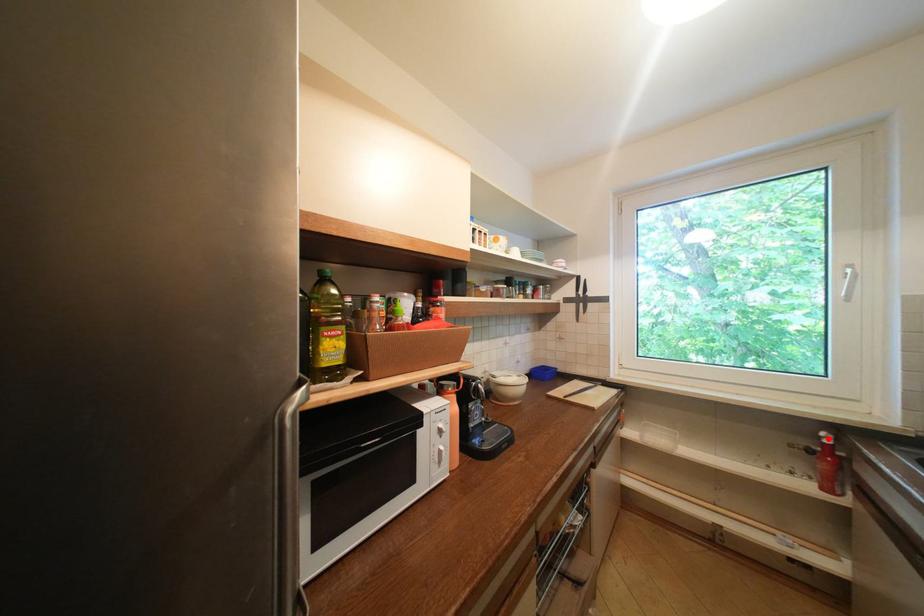
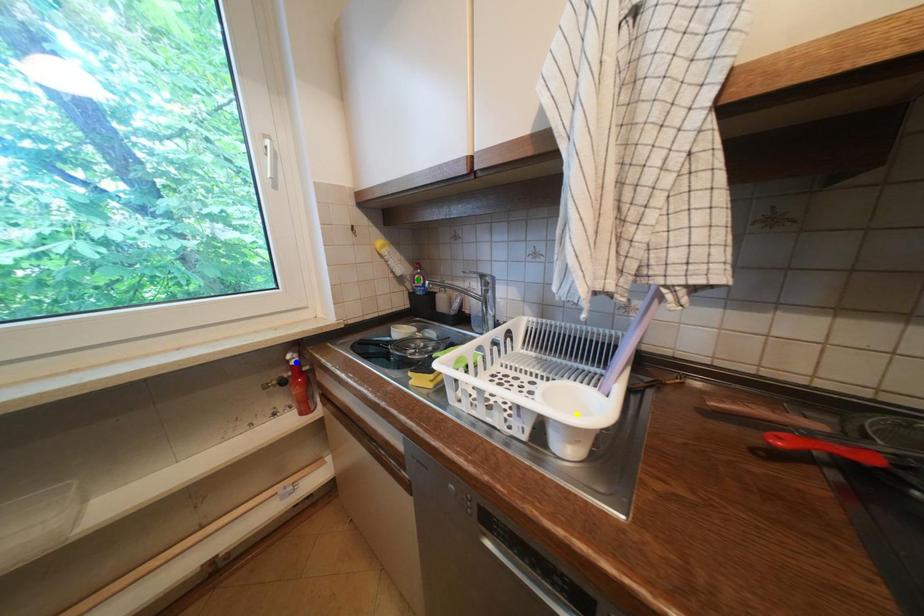
Question: I am providing you with two images of the same scene from different viewpoints. A red point is marked on the first image. You are given multiple points on the second image. Which point in image 2 represents the same 3d spot as the red point in image 1?

Choices:
 (A) yellow point
 (B) green point
 (C) blue point

Answer: (C)